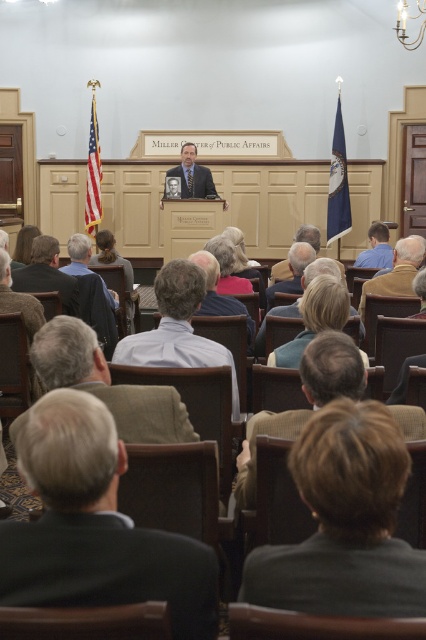
Question: Which of the following is the closest to the observer?

Choices:
 (A) (236, 416)
 (B) (138, 628)
 (C) (242, 618)
 (D) (210, 579)

Answer: (B)

Question: Does gray fabric chair at lower center have a smaller size compared to brown leather jacket at right?

Choices:
 (A) no
 (B) yes

Answer: (B)

Question: Which object appears closest to the camera in this image?

Choices:
 (A) matte black suit at center
 (B) light brown leather chair at center
 (C) brown leather chair at lower left
 (D) light brown leather jacket at center

Answer: (B)

Question: Does brown leather chair at lower center appear under light brown leather jacket at center?

Choices:
 (A) no
 (B) yes

Answer: (B)

Question: Which of these objects is positioned farthest from the light blue shirt at center?

Choices:
 (A) brown leather chair at lower center
 (B) gray fabric chair at center

Answer: (A)

Question: Is light blue shirt at center below light brown leather jacket at center?

Choices:
 (A) yes
 (B) no

Answer: (A)